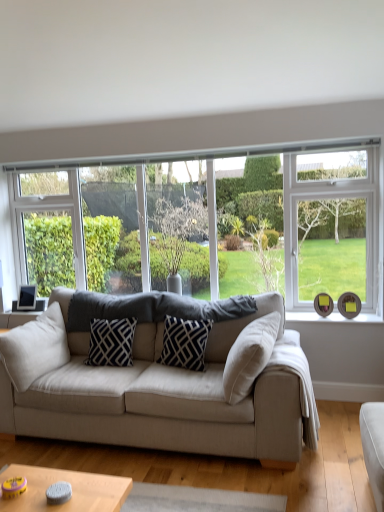
Question: Would you say clear glass window at center is part of beige fabric pillow at left, which is the 3th pillow from right to left,'s contents?

Choices:
 (A) no
 (B) yes

Answer: (A)

Question: Is beige fabric pillow at left, which is counted as the first pillow, starting from the left, oriented away from clear glass window at center?

Choices:
 (A) no
 (B) yes

Answer: (A)

Question: From the image's perspective, is beige fabric pillow at left, which is counted as the first pillow, starting from the left, under clear glass window at center?

Choices:
 (A) yes
 (B) no

Answer: (A)

Question: Does beige fabric pillow at left, which is counted as the first pillow, starting from the left, have a larger size compared to clear glass window at center?

Choices:
 (A) no
 (B) yes

Answer: (A)

Question: Considering the relative positions of beige fabric pillow at left, which is counted as the first pillow, starting from the left, and clear glass window at center in the image provided, is beige fabric pillow at left, which is counted as the first pillow, starting from the left, to the left of clear glass window at center from the viewer's perspective?

Choices:
 (A) no
 (B) yes

Answer: (B)

Question: Considering the relative sizes of beige fabric pillow at left, which is the 3th pillow from right to left, and clear glass window at center in the image provided, is beige fabric pillow at left, which is the 3th pillow from right to left, wider than clear glass window at center?

Choices:
 (A) no
 (B) yes

Answer: (B)

Question: From the image's perspective, is beige fabric pillow at left, which is counted as the first pillow, starting from the left, above green leafy tree at center?

Choices:
 (A) no
 (B) yes

Answer: (A)

Question: From the image's perspective, is beige fabric pillow at left, which is the 3th pillow from right to left, below green leafy tree at center?

Choices:
 (A) no
 (B) yes

Answer: (B)

Question: Does beige fabric pillow at left, which is counted as the first pillow, starting from the left, come behind green leafy tree at center?

Choices:
 (A) no
 (B) yes

Answer: (A)

Question: Can you confirm if beige fabric pillow at left, which is the 3th pillow from right to left, is positioned to the left of green leafy tree at center?

Choices:
 (A) no
 (B) yes

Answer: (B)

Question: Is beige fabric pillow at left, which is counted as the first pillow, starting from the left, at the right side of green leafy tree at center?

Choices:
 (A) yes
 (B) no

Answer: (B)

Question: Considering the relative sizes of beige fabric pillow at left, which is counted as the first pillow, starting from the left, and green leafy tree at center in the image provided, is beige fabric pillow at left, which is counted as the first pillow, starting from the left, bigger than green leafy tree at center?

Choices:
 (A) no
 (B) yes

Answer: (A)

Question: Does beige fabric pillow at left, which is the 3th pillow from right to left, have a greater height compared to black and white patterned pillow at center, acting as the 2th pillow starting from the left?

Choices:
 (A) yes
 (B) no

Answer: (A)